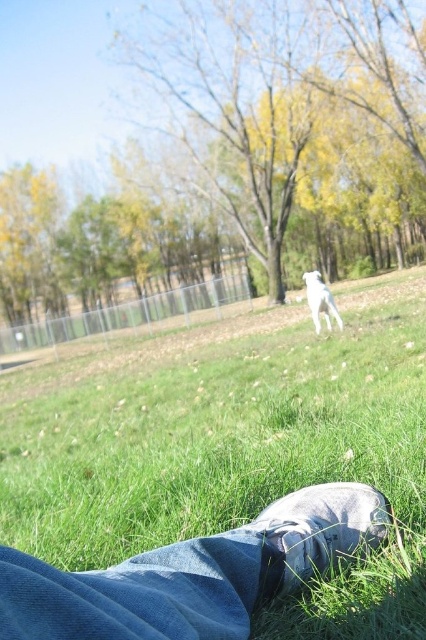
Does point (103, 588) lie behind point (290, 547)?

No.

Where is `denim jeans at lower center`? denim jeans at lower center is located at coordinates (192, 573).

Between point (296, 515) and point (317, 317), which one is positioned in front?

Positioned in front is point (296, 515).

Does denim jeans at lower center have a smaller size compared to white fur dog at center?

Yes, denim jeans at lower center is smaller than white fur dog at center.

What are the coordinates of `denim jeans at lower center` in the screenshot? It's located at (192, 573).

This screenshot has height=640, width=426. Identify the location of denim jeans at lower center. (192, 573).

Between green grassy field at center and white fur dog at center, which one has less height?

white fur dog at center

Is point (302, 372) more distant than point (328, 296)?

No, (302, 372) is closer to viewer.

Between point (284, 604) and point (321, 276), which one is positioned in front?

Positioned in front is point (284, 604).

Where is `green grassy field at center`? The image size is (426, 640). green grassy field at center is located at coordinates (x=232, y=445).